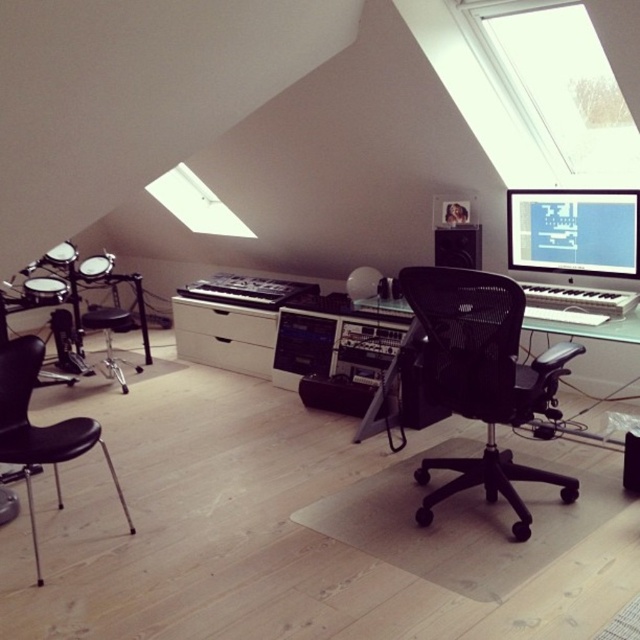
Which of these two, transparent glass window at upper center or matte black monitor at upper right, stands shorter?

matte black monitor at upper right is shorter.

Based on the photo, does transparent glass window at upper center appear over matte black monitor at upper right?

Yes, transparent glass window at upper center is above matte black monitor at upper right.

This screenshot has height=640, width=640. Describe the element at coordinates (554, 84) in the screenshot. I see `transparent glass window at upper center` at that location.

Identify the location of transparent glass window at upper center. This screenshot has width=640, height=640. (554, 84).

Is black mesh office chair at center wider than transparent glass window at upper center?

No, black mesh office chair at center is not wider than transparent glass window at upper center.

Describe the element at coordinates (483, 378) in the screenshot. The height and width of the screenshot is (640, 640). I see `black mesh office chair at center` at that location.

Identify the location of black mesh office chair at center. This screenshot has height=640, width=640. (483, 378).

Can you confirm if transparent glass window at upper center is smaller than black matte speaker at center?

No, transparent glass window at upper center is not smaller than black matte speaker at center.

Between point (625, 180) and point (438, 260), which one is positioned in front?

Point (625, 180) is in front.

Find the location of a particular element. transparent glass window at upper center is located at coordinates (554, 84).